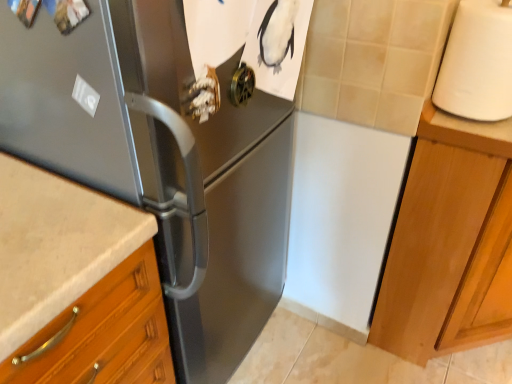
Locate an element on the screen. white matte countertop at right is located at coordinates (467, 123).

Where is `satin black refrigerator at left`? satin black refrigerator at left is located at coordinates (162, 159).

Considering the sizes of light wood cabinet at right and white matte countertop at right in the image, is light wood cabinet at right wider or thinner than white matte countertop at right?

Considering their sizes, light wood cabinet at right looks broader than white matte countertop at right.

Does light wood cabinet at right have a greater height compared to white matte countertop at right?

Yes.

From a real-world perspective, which is physically below, light wood cabinet at right or white matte countertop at right?

In real-world perspective, light wood cabinet at right is lower.

Between light wood cabinet at right and white matte countertop at right, which one is positioned behind?

white matte countertop at right.

From a real-world perspective, between satin black refrigerator at left and light wood cabinet at right, who is vertically higher?

From a 3D spatial view, satin black refrigerator at left is above.

From the image's perspective, is satin black refrigerator at left under light wood cabinet at right?

No, from the image's perspective, satin black refrigerator at left is not beneath light wood cabinet at right.

From the picture: Are satin black refrigerator at left and light wood cabinet at right located far from each other?

No, satin black refrigerator at left is not far from light wood cabinet at right.

In the scene shown: Can you confirm if satin black refrigerator at left is shorter than white matte countertop at right?

No.

Considering the points (248, 152) and (454, 119), which point is behind, point (248, 152) or point (454, 119)?

Point (454, 119)

Is the position of satin black refrigerator at left less distant than that of white matte countertop at right?

Yes, satin black refrigerator at left is closer to the camera.

Is satin black refrigerator at left positioned beyond the bounds of white matte countertop at right?

satin black refrigerator at left lies outside white matte countertop at right's area.

Is the position of white matte paper towel at right more distant than that of white matte countertop at right?

No, white matte paper towel at right is closer to the viewer.

From a real-world perspective, which is physically above, white matte paper towel at right or white matte countertop at right?

white matte paper towel at right, from a real-world perspective.

Is white matte paper towel at right inside the boundaries of white matte countertop at right, or outside?

white matte paper towel at right is spatially situated outside white matte countertop at right.

Can you confirm if light wood cabinet at right is thinner than satin black refrigerator at left?

Correct, the width of light wood cabinet at right is less than that of satin black refrigerator at left.

Is light wood cabinet at right far from satin black refrigerator at left?

No.

What's the angular difference between light wood cabinet at right and satin black refrigerator at left's facing directions?

The angular difference between light wood cabinet at right and satin black refrigerator at left is 2.36 degrees.

Which is further, (485, 157) or (58, 83)?

Positioned behind is point (485, 157).

Which of these two, white matte paper towel at right or light wood cabinet at right, is wider?

light wood cabinet at right.

From a real-world perspective, is white matte paper towel at right physically located above or below light wood cabinet at right?

From a real-world perspective, white matte paper towel at right is physically above light wood cabinet at right.

Is white matte paper towel at right oriented away from light wood cabinet at right?

white matte paper towel at right is not turned away from light wood cabinet at right.

Is white matte paper towel at right located outside light wood cabinet at right?

Absolutely, white matte paper towel at right is external to light wood cabinet at right.

Is white matte countertop at right not within satin black refrigerator at left?

white matte countertop at right is positioned outside satin black refrigerator at left.

Is white matte countertop at right facing towards satin black refrigerator at left?

No.

From a real-world perspective, does white matte countertop at right stand above satin black refrigerator at left?

Correct, in the physical world, white matte countertop at right is higher than satin black refrigerator at left.

Identify the location of refrigerator below the white matte countertop at right (from a real-world perspective). The width and height of the screenshot is (512, 384). (162, 159).

At what (x,y) coordinates should I click in order to perform the action: click on counter top above the light wood cabinet at right (from a real-world perspective). Please return your answer as a coordinate pair (x, y). Image resolution: width=512 pixels, height=384 pixels. Looking at the image, I should click on (467, 123).

Where is `cabinetry located underneath the satin black refrigerator at left (from a real-world perspective)`? This screenshot has height=384, width=512. cabinetry located underneath the satin black refrigerator at left (from a real-world perspective) is located at coordinates (445, 239).

Which object lies further to the anchor point white matte paper towel at right, light wood cabinet at right or satin black refrigerator at left?

satin black refrigerator at left lies further to white matte paper towel at right than the other object.

From the image, which object appears to be nearer to satin black refrigerator at left, white matte paper towel at right or white matte countertop at right?

Among the two, white matte paper towel at right is located nearer to satin black refrigerator at left.

Based on their spatial positions, is white matte paper towel at right or light wood cabinet at right closer to satin black refrigerator at left?

The object closer to satin black refrigerator at left is white matte paper towel at right.

Considering their positions, is white matte countertop at right positioned closer to white matte paper towel at right than light wood cabinet at right?

white matte countertop at right.

Considering their positions, is satin black refrigerator at left positioned closer to white matte paper towel at right than light wood cabinet at right?

Among the two, light wood cabinet at right is located nearer to white matte paper towel at right.

From the image, which object appears to be farther from white matte paper towel at right, white matte countertop at right or satin black refrigerator at left?

The object further to white matte paper towel at right is satin black refrigerator at left.

When comparing their distances from light wood cabinet at right, does white matte paper towel at right or satin black refrigerator at left seem further?

The object further to light wood cabinet at right is satin black refrigerator at left.

Estimate the real-world distances between objects in this image. Which object is further from white matte countertop at right, light wood cabinet at right or satin black refrigerator at left?

satin black refrigerator at left lies further to white matte countertop at right than the other object.

This screenshot has height=384, width=512. Identify the location of paper towel between satin black refrigerator at left and white matte countertop at right in the horizontal direction. (477, 62).

I want to click on counter top situated between satin black refrigerator at left and light wood cabinet at right from left to right, so click(467, 123).

Where is `paper towel situated between satin black refrigerator at left and light wood cabinet at right from left to right`? paper towel situated between satin black refrigerator at left and light wood cabinet at right from left to right is located at coordinates (477, 62).

What are the coordinates of `counter top between white matte paper towel at right and light wood cabinet at right in the up-down direction` in the screenshot? It's located at (467, 123).